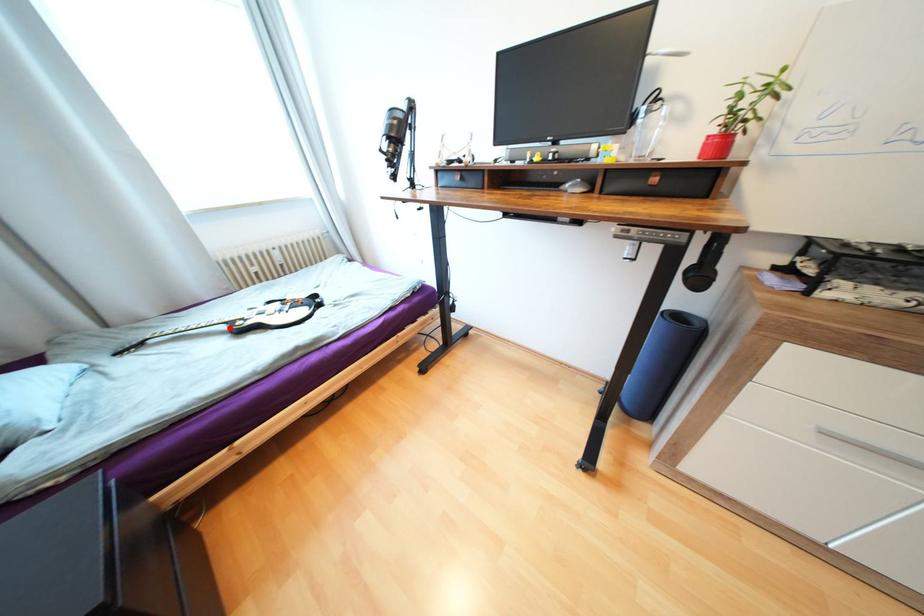
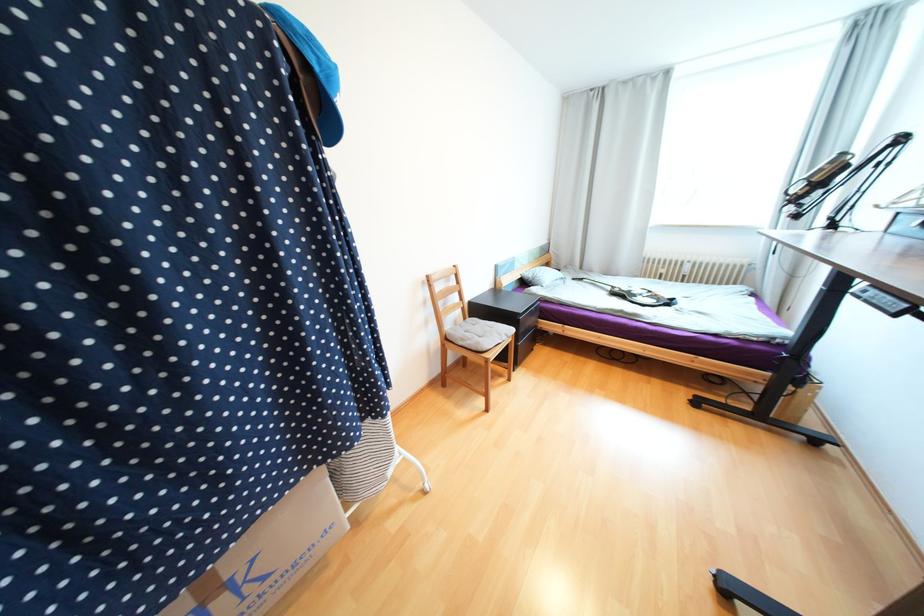
In the second image, find the point that corresponds to the highlighted location in the first image.

(614, 288)